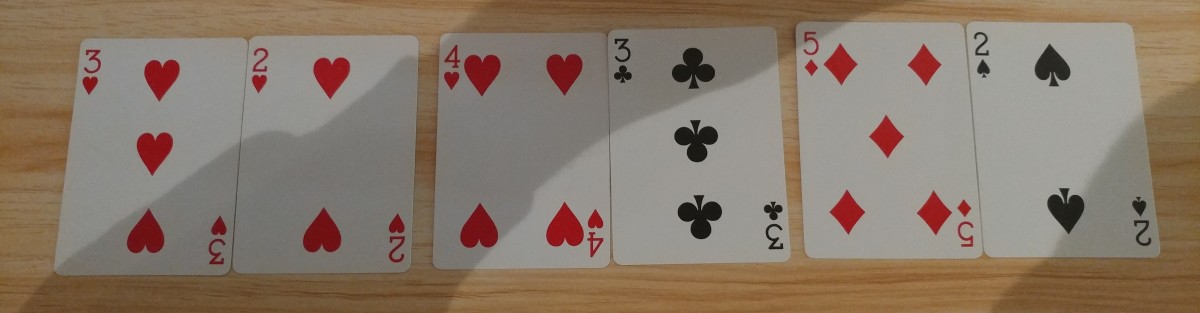
The height and width of the screenshot is (313, 1200). What are the coordinates of `playing cards` in the screenshot? It's located at (196, 158), (330, 63), (491, 142), (688, 115), (888, 111), (1014, 121).